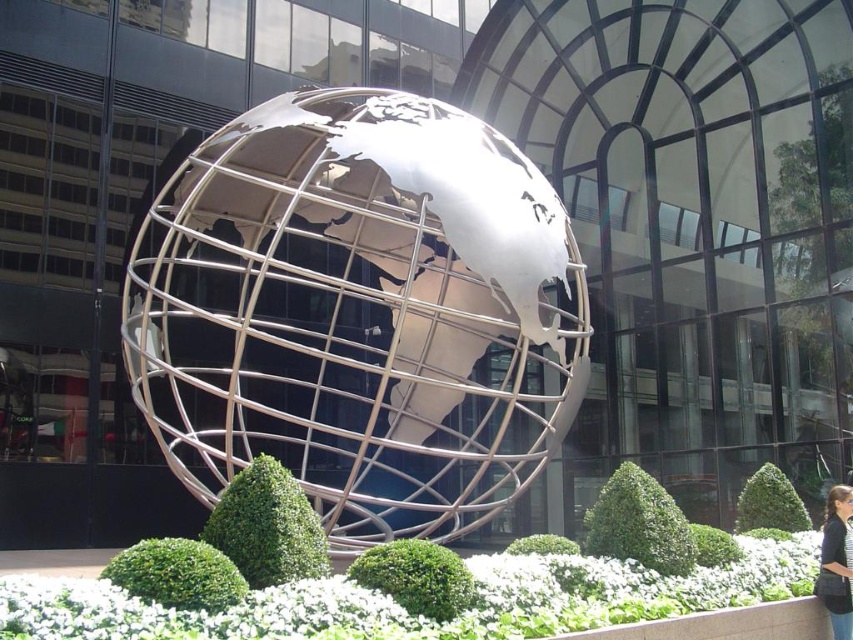
Does metallic silver globe at center appear on the right side of black fabric hair at lower right?

In fact, metallic silver globe at center is to the left of black fabric hair at lower right.

The image size is (853, 640). What are the coordinates of `metallic silver globe at center` in the screenshot? It's located at pos(358,312).